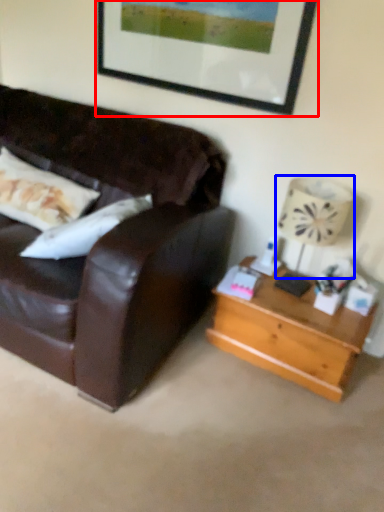
Question: Which of the following is the farthest to the observer, picture frame (highlighted by a red box) or lamp (highlighted by a blue box)?

Choices:
 (A) picture frame
 (B) lamp

Answer: (A)